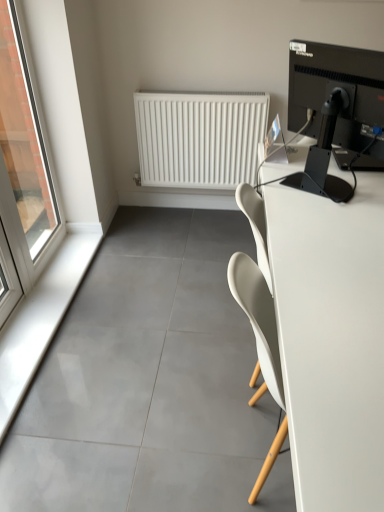
You are a GUI agent. You are given a task and a screenshot of the screen. Output one action in this format:
    pyautogui.click(x=<x>, y=<y>)
    Task: Click on the free space above white glossy window sill at lower left (from a real-world perspective)
    The width and height of the screenshot is (384, 512).
    Given the screenshot: What is the action you would take?
    pyautogui.click(x=36, y=305)